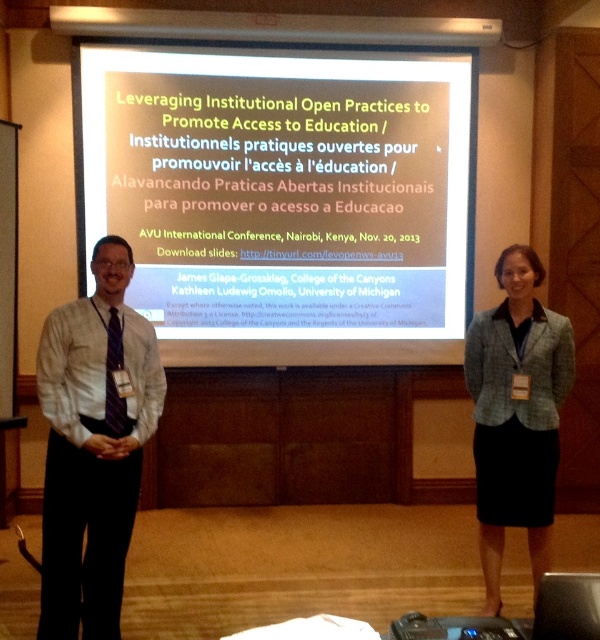
Question: From the image, what is the correct spatial relationship of white matte projection screen at center in relation to green tweed blazer at center?

Choices:
 (A) above
 (B) below

Answer: (A)

Question: Considering the real-world distances, which object is closest to the white shirt at left?

Choices:
 (A) white matte projection screen at center
 (B) green tweed blazer at center

Answer: (B)

Question: From the image, what is the correct spatial relationship of white matte projection screen at center in relation to green tweed blazer at center?

Choices:
 (A) left
 (B) right

Answer: (A)

Question: Which is nearer to the green tweed blazer at center?

Choices:
 (A) white shirt at left
 (B) white matte projection screen at center

Answer: (B)

Question: Does white matte projection screen at center appear on the right side of white shirt at left?

Choices:
 (A) no
 (B) yes

Answer: (B)

Question: Which of the following is the closest to the observer?

Choices:
 (A) (162, 305)
 (B) (135, 412)
 (C) (502, 433)

Answer: (B)